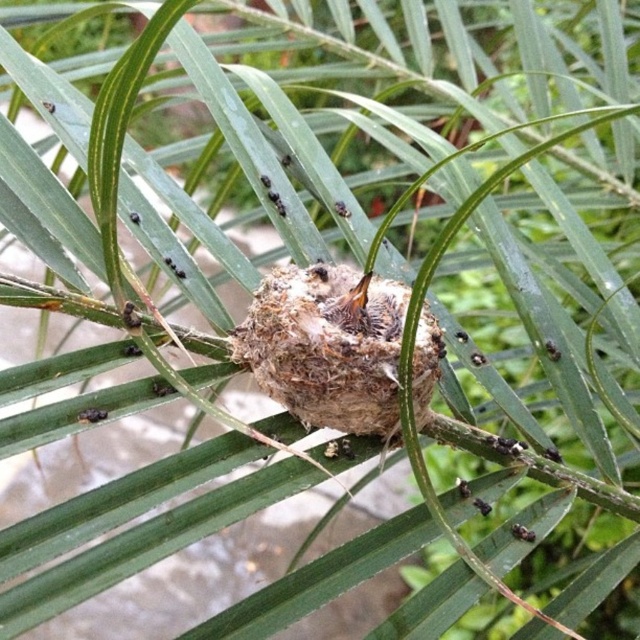
You are a tiny insect explorer. You see a brown fuzzy nest at center and a black glossy ant at center. Which object is wider?

The brown fuzzy nest at center is wider than the black glossy ant at center.

You are a bird looking for a place to rest. You see a point marked at coordinates (x=326, y=346) in the palm tree. What is located at that point?

At point (x=326, y=346) lies a brown fuzzy nest at center, which is the location you should rest.

You are an entomologist observing the palm tree nest. You notice two ants at the center of the scene. Which ant is closer to you, the black glossy ant at center or the black matte ant at center?

The black glossy ant at center is closer to you because it is positioned in front of the black matte ant at center.